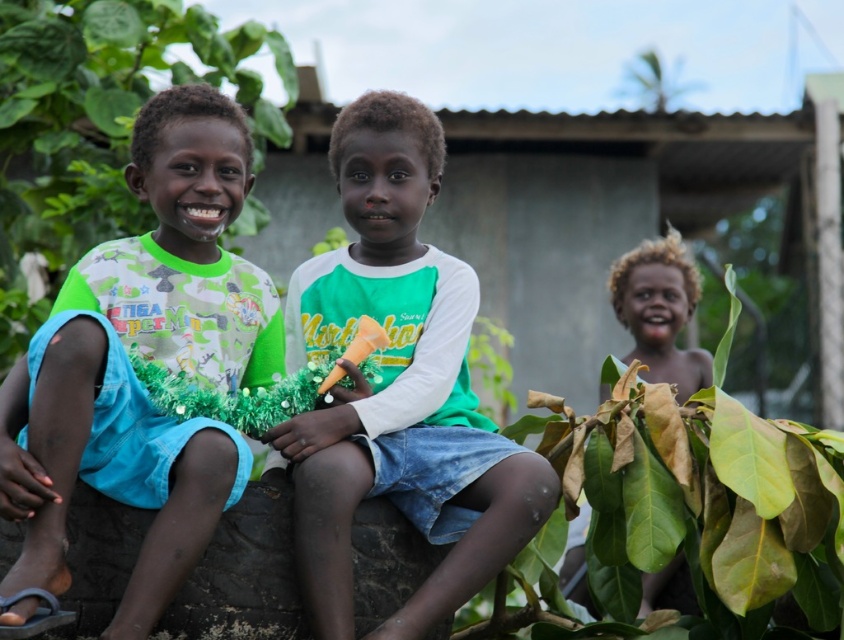
You are a photographer trying to capture a clear shot of the light brown hair at lower right. However, the green leafy plant at right is blocking your view. Can you adjust your position to move the plant out of the frame?

The green leafy plant at right is located below the light brown hair at lower right, so moving the camera upwards might help remove the plant from the frame while keeping the light brown hair at lower right visible.

You are a photographer trying to capture the perfect shot of the green matte shirt at center. Based on its coordinates, where should you position your camera to ensure it is centered in the frame?

The green matte shirt at center is located at coordinates point (399,387), so positioning the camera directly facing that point will center it in the frame.